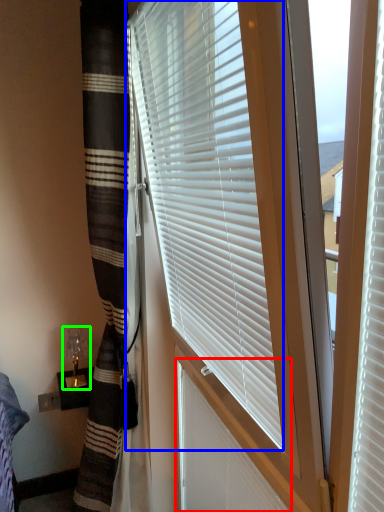
Question: Which object is the farthest from shutter (highlighted by a red box)? Choose among these: window blind (highlighted by a blue box) or table lamp (highlighted by a green box).

Choices:
 (A) window blind
 (B) table lamp

Answer: (B)